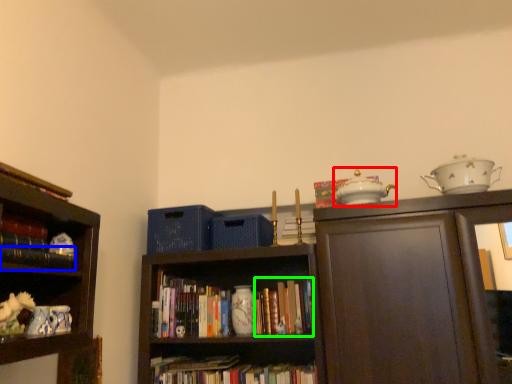
Question: Based on their relative distances, which object is farther from tea pot (highlighted by a red box)? Choose from book (highlighted by a blue box) and book (highlighted by a green box).

Choices:
 (A) book
 (B) book

Answer: (A)